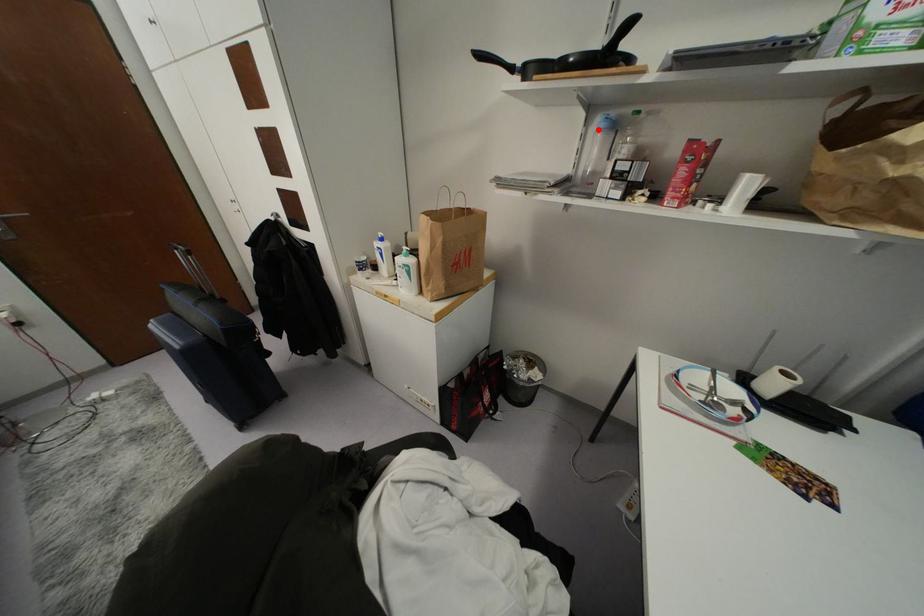
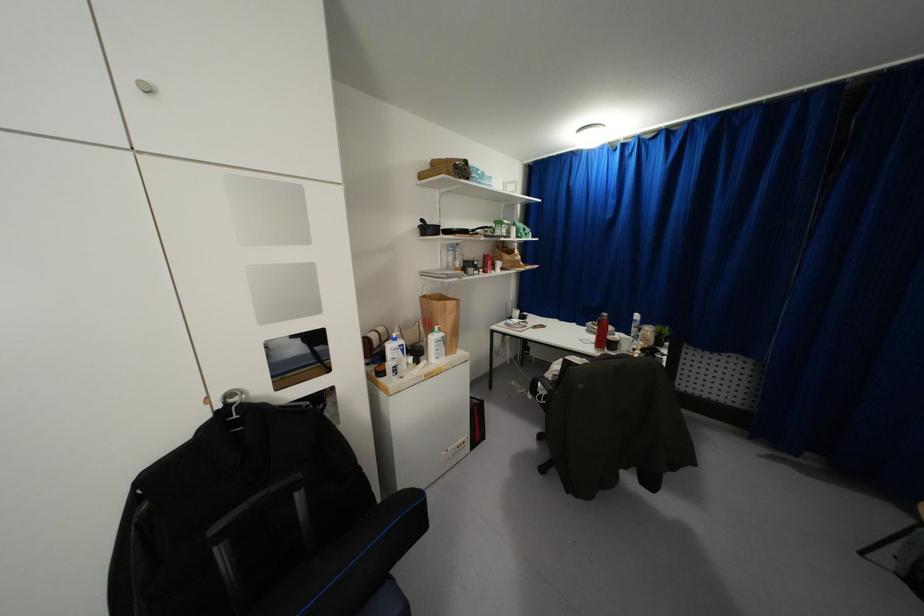
Find the pixel in the second image that matches the highlighted location in the first image.

(446, 249)